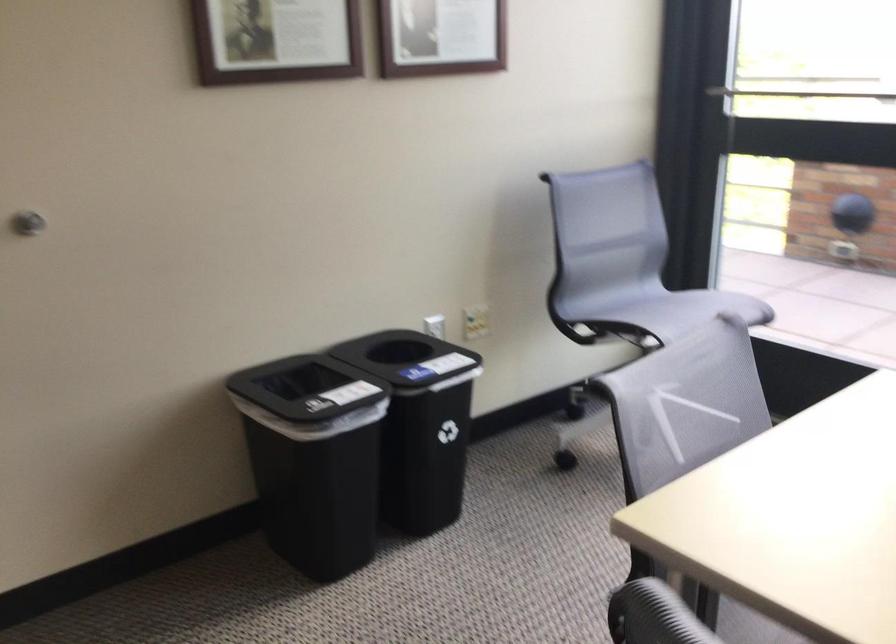
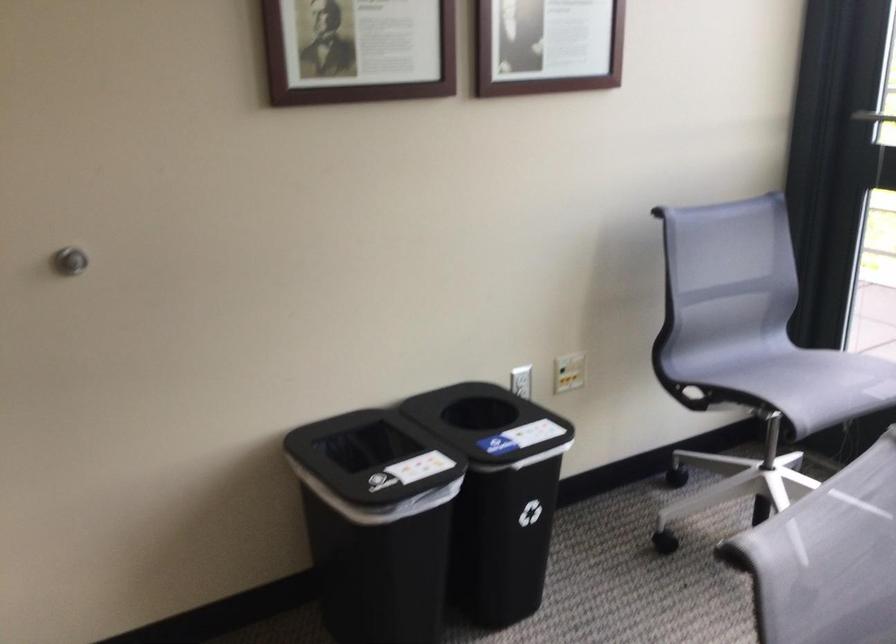
Find the pixel in the second image that matches [563,323] in the first image.

(668, 382)